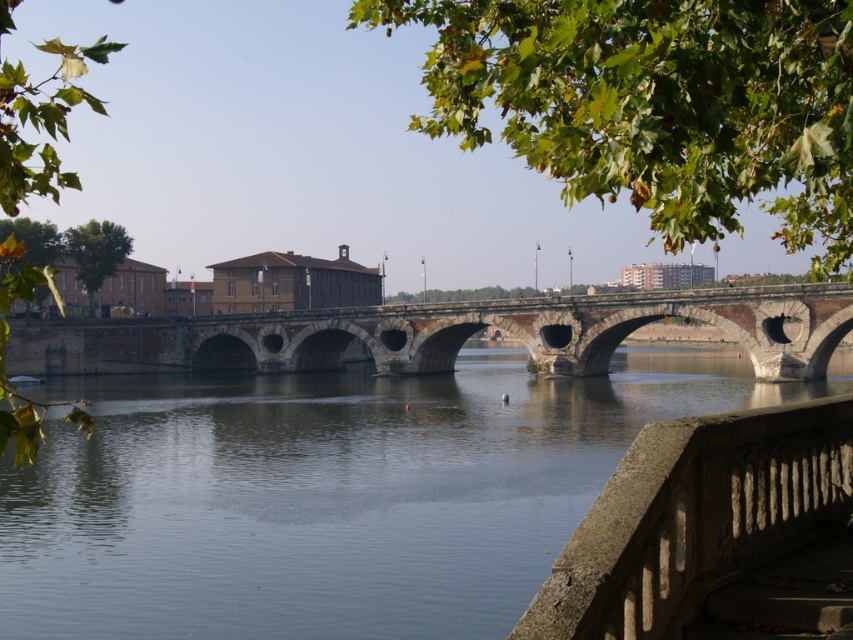
Is gray stone balustrade at lower right below brown stone bridge at center?

Correct, gray stone balustrade at lower right is located below brown stone bridge at center.

This screenshot has height=640, width=853. I want to click on gray stone balustrade at lower right, so click(695, 516).

Is clear water at bridge center to the right of brown stone bridge at center from the viewer's perspective?

Indeed, clear water at bridge center is positioned on the right side of brown stone bridge at center.

Does clear water at bridge center come in front of brown stone bridge at center?

Yes, clear water at bridge center is closer to the viewer.

Which is in front, point (386, 552) or point (746, 324)?

Point (386, 552) is in front.

This screenshot has height=640, width=853. What are the coordinates of `clear water at bridge center` in the screenshot? It's located at (332, 493).

Is clear water at bridge center positioned before gray stone balustrade at lower right?

That is False.

Can you confirm if clear water at bridge center is thinner than gray stone balustrade at lower right?

In fact, clear water at bridge center might be wider than gray stone balustrade at lower right.

Identify the location of clear water at bridge center. (332, 493).